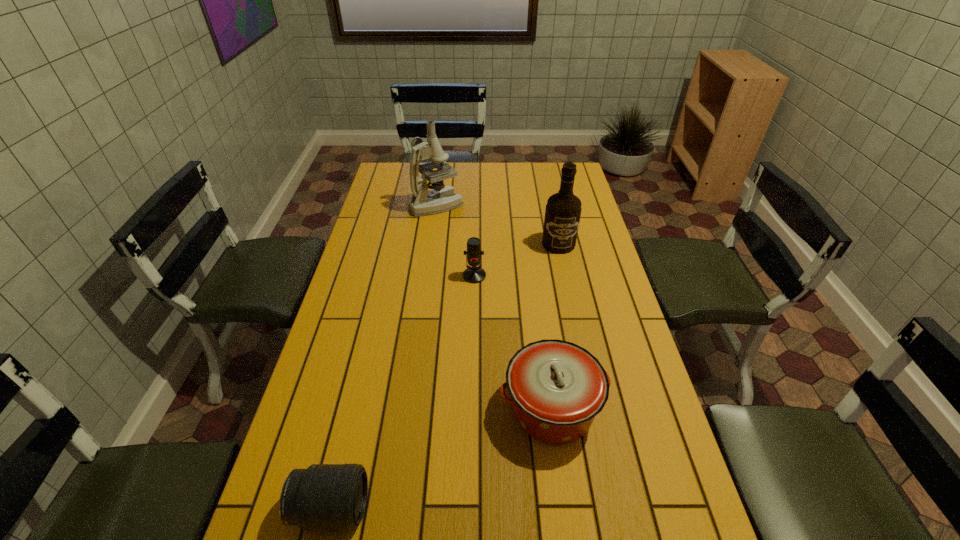
Locate an element on the screen. object that can be found as the third closest to the microscope is located at coordinates (557, 388).

Point out which object is positioned as the third nearest to the microscope. Please provide its 2D coordinates. Your answer should be formatted as a tuple, i.e. [(x, y)], where the tuple contains the x and y coordinates of a point satisfying the conditions above.

[(557, 388)]

Identify the location of free location that satisfies the following two spatial constraints: 1. on the side of the casserole with the red ring; 2. on the left side of the microphone. (472, 407).